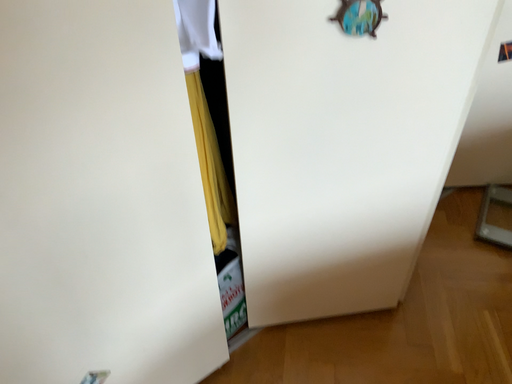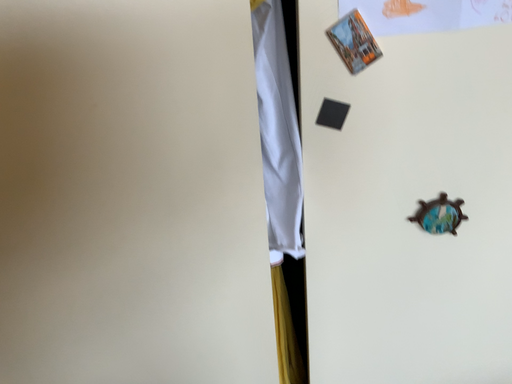
Question: How did the camera likely rotate when shooting the video?

Choices:
 (A) rotated upward
 (B) rotated downward

Answer: (A)